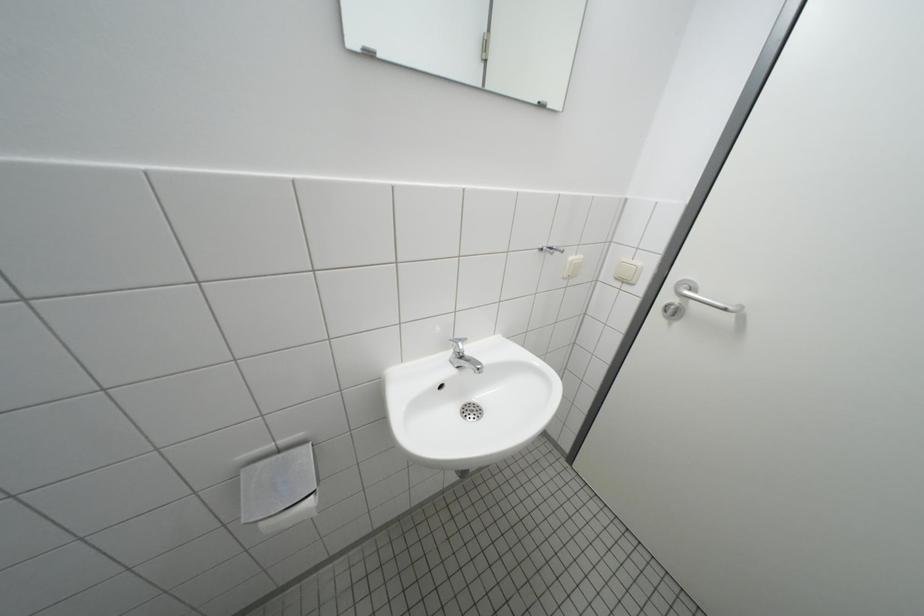
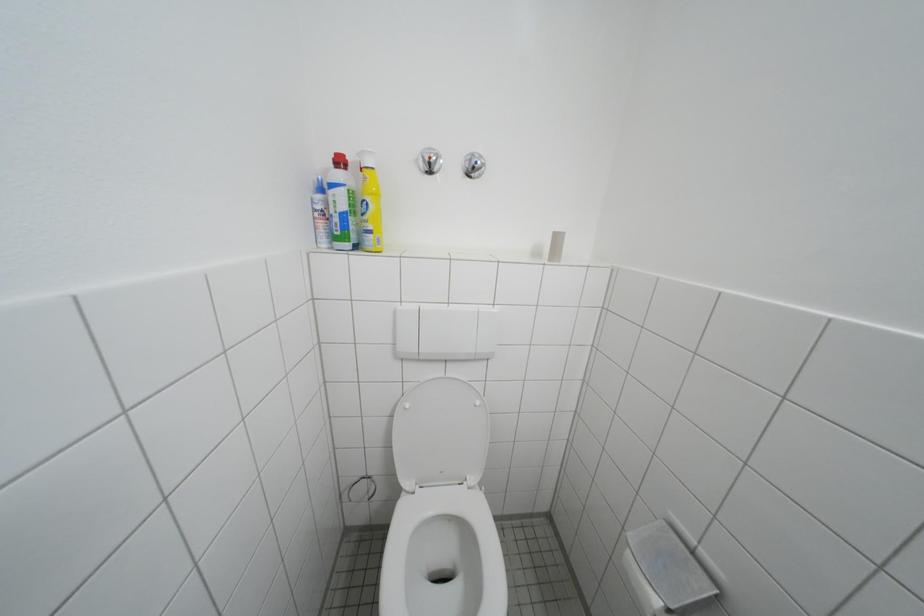
First-person continuous shooting, in which direction is the camera rotating?

The camera's rotation is toward left-down.